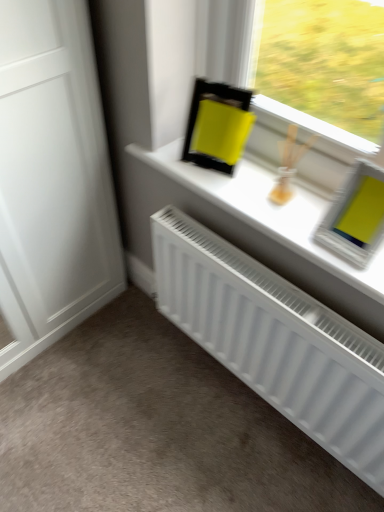
The width and height of the screenshot is (384, 512). Find the location of `free space above white matte window sill at upper center (from a real-world perspective)`. free space above white matte window sill at upper center (from a real-world perspective) is located at coordinates (271, 184).